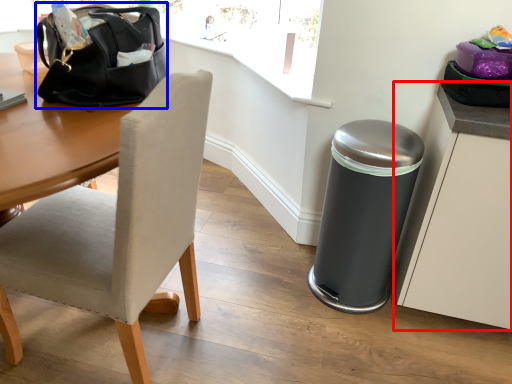
Question: Which object appears farthest to the camera in this image, cabinetry (highlighted by a red box) or handbag (highlighted by a blue box)?

Choices:
 (A) cabinetry
 (B) handbag

Answer: (A)